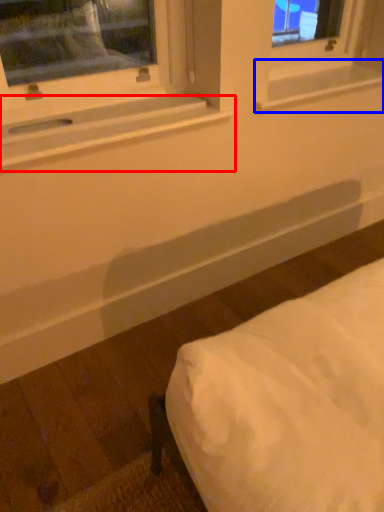
Question: Among these objects, which one is nearest to the camera, window sill (highlighted by a red box) or window sill (highlighted by a blue box)?

Choices:
 (A) window sill
 (B) window sill

Answer: (A)